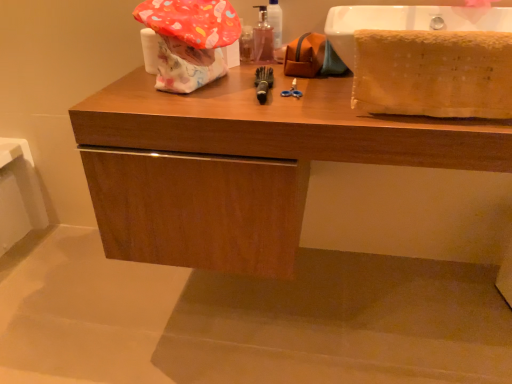
You are a GUI agent. You are given a task and a screenshot of the screen. Output one action in this format:
    pyautogui.click(x=<x>, y=<y>)
    Task: Click on the free space behind black rubber toothbrush at center
    Image resolution: width=512 pixels, height=384 pixels.
    Given the screenshot: What is the action you would take?
    pyautogui.click(x=247, y=76)